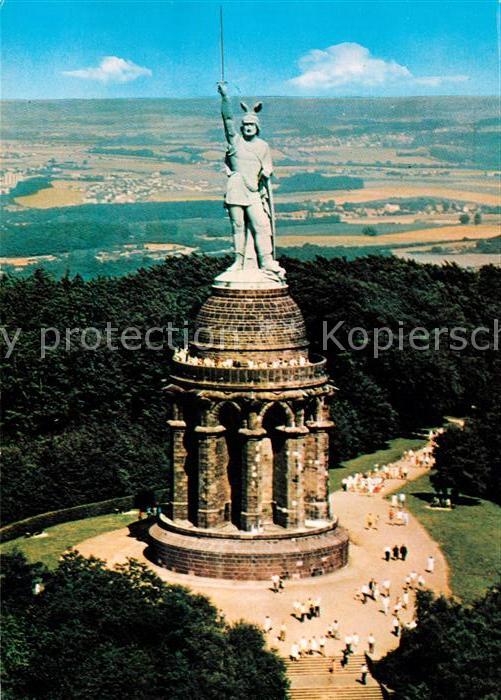
This screenshot has width=501, height=700. In order to click on sets of stairs in this screenshot , I will do `click(327, 694)`, `click(315, 663)`.